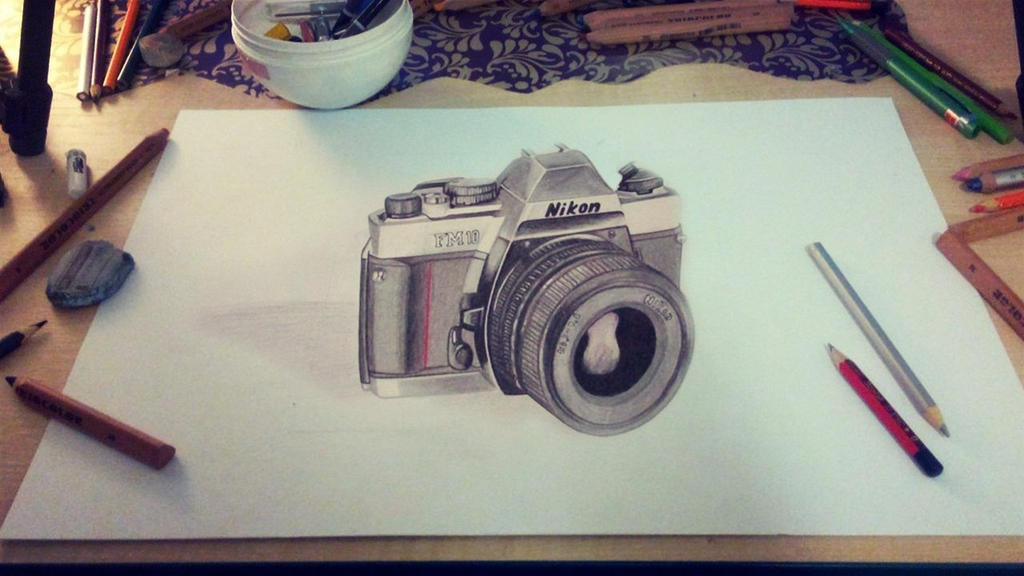
Where is `artwork`? This screenshot has height=576, width=1024. artwork is located at coordinates (662, 263).